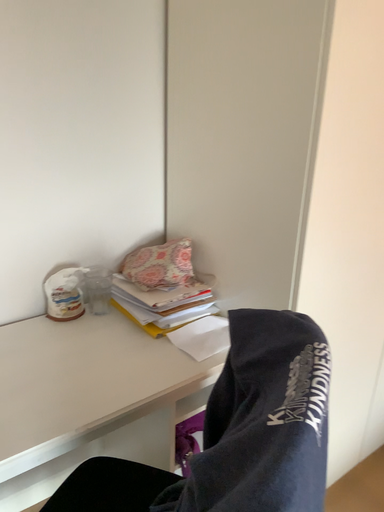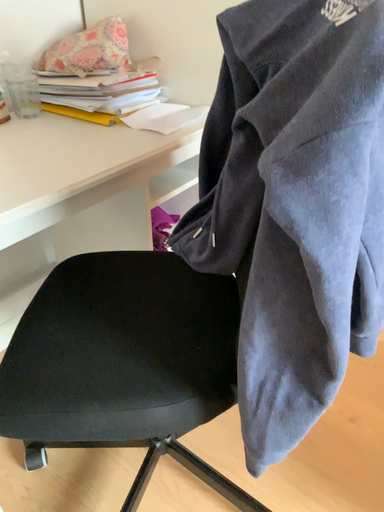
Question: Which way did the camera rotate in the video?

Choices:
 (A) rotated downward
 (B) rotated upward

Answer: (A)